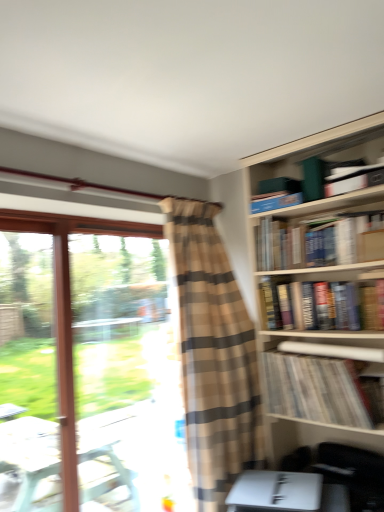
The image size is (384, 512). What do you see at coordinates (87, 372) in the screenshot?
I see `clear glass window at left` at bounding box center [87, 372].

Describe the element at coordinates (314, 389) in the screenshot. I see `striped paper at upper right, which ranks as the 6th book in top-to-bottom order` at that location.

Describe the element at coordinates (354, 179) in the screenshot. I see `white cardboard box at upper right, the sixth book when ordered from bottom to top` at that location.

Where is `white matte paperback book at lower right`? white matte paperback book at lower right is located at coordinates (276, 492).

Locate an element on the screen. hardcover book at upper right, marked as the fourth book in a bottom-to-top arrangement is located at coordinates (319, 242).

This screenshot has width=384, height=512. I want to click on clear glass window at left, so click(87, 372).

Considering the relative sizes of blue hardcover book at upper right, which is counted as the fifth book, starting from the bottom, and white matte paperback book at lower right in the image provided, is blue hardcover book at upper right, which is counted as the fifth book, starting from the bottom, thinner than white matte paperback book at lower right?

Yes, blue hardcover book at upper right, which is counted as the fifth book, starting from the bottom, is thinner than white matte paperback book at lower right.

From a real-world perspective, between blue hardcover book at upper right, which is counted as the fifth book, starting from the bottom, and white matte paperback book at lower right, who is vertically higher?

blue hardcover book at upper right, which is counted as the fifth book, starting from the bottom, from a real-world perspective.

Is blue hardcover book at upper right, which is the second book in top-to-bottom order, positioned with its back to white matte paperback book at lower right?

No, white matte paperback book at lower right is not at the back of blue hardcover book at upper right, which is the second book in top-to-bottom order.

Does blue hardcover book at upper right, which is the second book in top-to-bottom order, lie behind white matte paperback book at lower right?

Yes, it is.

This screenshot has height=512, width=384. What are the coordinates of `the 2nd book directly above the white paper at center-right, placed as the 2th book when sorted from bottom to top (from a real-world perspective)` in the screenshot? It's located at (319, 242).

Can you tell me how much white paper at center-right, acting as the fifth book starting from the top, and hardcover book at upper right, marked as the fourth book in a bottom-to-top arrangement, differ in facing direction?

The angle between the facing direction of white paper at center-right, acting as the fifth book starting from the top, and the facing direction of hardcover book at upper right, marked as the fourth book in a bottom-to-top arrangement, is 0.00211 degrees.

Consider the image. Which is closer, (328,355) or (349,219)?

Point (328,355) is positioned closer to the camera compared to point (349,219).

Considering the sizes of objects white paper at center-right, acting as the fifth book starting from the top, and hardcover book at upper right, which is the 3th book from top to bottom, in the image provided, who is thinner, white paper at center-right, acting as the fifth book starting from the top, or hardcover book at upper right, which is the 3th book from top to bottom,?

With smaller width is white paper at center-right, acting as the fifth book starting from the top.

Considering the positions of objects hardcover books at upper right, marked as the 4th book in a top-to-bottom arrangement, and striped paper at upper right, which ranks as the 6th book in top-to-bottom order, in the image provided, who is in front, hardcover books at upper right, marked as the 4th book in a top-to-bottom arrangement, or striped paper at upper right, which ranks as the 6th book in top-to-bottom order,?

Positioned in front is striped paper at upper right, which ranks as the 6th book in top-to-bottom order.

Considering the relative sizes of hardcover books at upper right, placed as the 3th book when sorted from bottom to top, and striped paper at upper right, the 1th book in the bottom-to-top sequence, in the image provided, is hardcover books at upper right, placed as the 3th book when sorted from bottom to top, thinner than striped paper at upper right, the 1th book in the bottom-to-top sequence,?

Correct, the width of hardcover books at upper right, placed as the 3th book when sorted from bottom to top, is less than that of striped paper at upper right, the 1th book in the bottom-to-top sequence.

From the image's perspective, is hardcover books at upper right, placed as the 3th book when sorted from bottom to top, over striped paper at upper right, the 1th book in the bottom-to-top sequence?

Yes.

Identify the location of the 1st book behind the striped paper at upper right, the 1th book in the bottom-to-top sequence. This screenshot has height=512, width=384. (323, 305).

Is the surface of hardcover book at upper right, marked as the fourth book in a bottom-to-top arrangement, in direct contact with white cardboard box at upper right, the sixth book when ordered from bottom to top?

No, hardcover book at upper right, marked as the fourth book in a bottom-to-top arrangement, is not in contact with white cardboard box at upper right, the sixth book when ordered from bottom to top.

Is hardcover book at upper right, which is the 3th book from top to bottom, not within white cardboard box at upper right, the sixth book when ordered from bottom to top?

Yes.

Is point (280, 247) positioned after point (353, 187)?

Yes, it is.

Between hardcover book at upper right, marked as the fourth book in a bottom-to-top arrangement, and white cardboard box at upper right, the sixth book when ordered from bottom to top, which one has more height?

hardcover book at upper right, marked as the fourth book in a bottom-to-top arrangement.

Considering the relative sizes of hardcover book at upper right, marked as the fourth book in a bottom-to-top arrangement, and white matte paperback book at lower right in the image provided, is hardcover book at upper right, marked as the fourth book in a bottom-to-top arrangement, shorter than white matte paperback book at lower right?

No, hardcover book at upper right, marked as the fourth book in a bottom-to-top arrangement, is not shorter than white matte paperback book at lower right.

Between point (258, 229) and point (288, 508), which one is positioned in front?

The point (288, 508) is closer.

From a real-world perspective, who is located lower, hardcover book at upper right, marked as the fourth book in a bottom-to-top arrangement, or white matte paperback book at lower right?

white matte paperback book at lower right.

Is hardcover book at upper right, which is the 3th book from top to bottom, looking in the opposite direction of white matte paperback book at lower right?

No.

From the image's perspective, which is above, white cardboard box at upper right, the sixth book when ordered from bottom to top, or white matte paperback book at lower right?

From the image's view, white cardboard box at upper right, the sixth book when ordered from bottom to top, is above.

From a real-world perspective, is white cardboard box at upper right, the sixth book when ordered from bottom to top, on top of white matte paperback book at lower right?

Indeed, from a real-world perspective, white cardboard box at upper right, the sixth book when ordered from bottom to top, stands above white matte paperback book at lower right.

Is white cardboard box at upper right, marked as the first book in a top-to-bottom arrangement, not within white matte paperback book at lower right?

Yes, white cardboard box at upper right, marked as the first book in a top-to-bottom arrangement, is located beyond the bounds of white matte paperback book at lower right.

Is striped paper at upper right, the 1th book in the bottom-to-top sequence, spatially inside blue hardcover book at upper right, which is counted as the fifth book, starting from the bottom, or outside of it?

striped paper at upper right, the 1th book in the bottom-to-top sequence, lies outside blue hardcover book at upper right, which is counted as the fifth book, starting from the bottom.

Considering the relative sizes of striped paper at upper right, which ranks as the 6th book in top-to-bottom order, and blue hardcover book at upper right, which is counted as the fifth book, starting from the bottom, in the image provided, is striped paper at upper right, which ranks as the 6th book in top-to-bottom order, taller than blue hardcover book at upper right, which is counted as the fifth book, starting from the bottom,?

Yes.

Between point (335, 376) and point (263, 209), which one is positioned in front?

The point (335, 376) is closer to the camera.

In the scene shown: Is striped paper at upper right, which ranks as the 6th book in top-to-bottom order, aimed at blue hardcover book at upper right, which is the second book in top-to-bottom order?

No, striped paper at upper right, which ranks as the 6th book in top-to-bottom order, is not oriented towards blue hardcover book at upper right, which is the second book in top-to-bottom order.

Identify the location of the 6th book behind the white matte paperback book at lower right. This screenshot has height=512, width=384. (274, 201).

Image resolution: width=384 pixels, height=512 pixels. I want to click on book that is the 2nd one when counting leftward from the white paper at center-right, placed as the 2th book when sorted from bottom to top, so click(319, 242).

When comparing their distances from blue hardcover book at upper right, which is the second book in top-to-bottom order, does hardcover books at upper right, placed as the 3th book when sorted from bottom to top, or hardcover book at upper right, which is the 3th book from top to bottom, seem closer?

The object closer to blue hardcover book at upper right, which is the second book in top-to-bottom order, is hardcover book at upper right, which is the 3th book from top to bottom.

When comparing their distances from clear glass window at left, does white cardboard box at upper right, the sixth book when ordered from bottom to top, or white matte paperback book at lower right seem further?

white cardboard box at upper right, the sixth book when ordered from bottom to top.

Considering their positions, is brown plaid curtain at center positioned closer to hardcover books at upper right, marked as the 4th book in a top-to-bottom arrangement, than white matte paperback book at lower right?

brown plaid curtain at center is positioned closer to the anchor hardcover books at upper right, marked as the 4th book in a top-to-bottom arrangement.

Which object lies nearer to the anchor point hardcover books at upper right, placed as the 3th book when sorted from bottom to top, brown plaid curtain at center or clear glass window at left?

brown plaid curtain at center is positioned closer to the anchor hardcover books at upper right, placed as the 3th book when sorted from bottom to top.

Looking at the image, which one is located further to brown plaid curtain at center, striped paper at upper right, the 1th book in the bottom-to-top sequence, or blue hardcover book at upper right, which is counted as the fifth book, starting from the bottom?

Among the two, blue hardcover book at upper right, which is counted as the fifth book, starting from the bottom, is located further to brown plaid curtain at center.

Estimate the real-world distances between objects in this image. Which object is further from white cardboard box at upper right, marked as the first book in a top-to-bottom arrangement, white matte paperback book at lower right or striped paper at upper right, the 1th book in the bottom-to-top sequence?

white matte paperback book at lower right lies further to white cardboard box at upper right, marked as the first book in a top-to-bottom arrangement, than the other object.

Which object lies nearer to the anchor point white paper at center-right, acting as the fifth book starting from the top, clear glass window at left or hardcover books at upper right, placed as the 3th book when sorted from bottom to top?

hardcover books at upper right, placed as the 3th book when sorted from bottom to top, is closer to white paper at center-right, acting as the fifth book starting from the top.

Consider the image. When comparing their distances from hardcover books at upper right, marked as the 4th book in a top-to-bottom arrangement, does white paper at center-right, acting as the fifth book starting from the top, or clear glass window at left seem closer?

white paper at center-right, acting as the fifth book starting from the top, lies closer to hardcover books at upper right, marked as the 4th book in a top-to-bottom arrangement, than the other object.

Find the location of a particular element. book between blue hardcover book at upper right, which is counted as the fifth book, starting from the bottom, and hardcover books at upper right, marked as the 4th book in a top-to-bottom arrangement, vertically is located at coordinates (319, 242).

Find the location of a particular element. paperback book between clear glass window at left and striped paper at upper right, the 1th book in the bottom-to-top sequence, from left to right is located at coordinates (276, 492).

You are a GUI agent. You are given a task and a screenshot of the screen. Output one action in this format:
    pyautogui.click(x=<x>, y=<y>)
    Task: Click on the curtain between hardcover books at upper right, marked as the 4th book in a top-to-bottom arrangement, and white matte paperback book at lower right vertically
    Image resolution: width=384 pixels, height=512 pixels.
    Given the screenshot: What is the action you would take?
    pyautogui.click(x=213, y=354)

You are a GUI agent. You are given a task and a screenshot of the screen. Output one action in this format:
    pyautogui.click(x=<x>, y=<y>)
    Task: Click on the curtain situated between clear glass window at left and white paper at center-right, placed as the 2th book when sorted from bottom to top, from left to right
    The width and height of the screenshot is (384, 512).
    Given the screenshot: What is the action you would take?
    pyautogui.click(x=213, y=354)